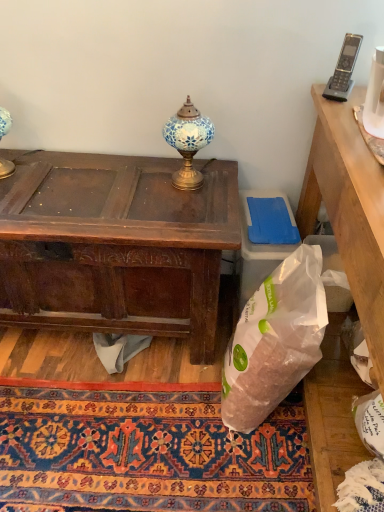
I want to click on free space to the left of translucent white plastic bag at lower right, so (178, 400).